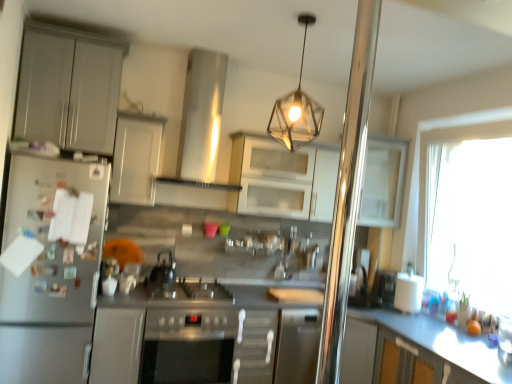
Question: Is stainless steel oven at center at the right side of white matte cabinet at upper center, arranged as the third cabinetry when viewed from the right?

Choices:
 (A) no
 (B) yes

Answer: (B)

Question: Is stainless steel oven at center facing away from white matte cabinet at upper center, arranged as the third cabinetry when viewed from the right?

Choices:
 (A) no
 (B) yes

Answer: (A)

Question: Would you say stainless steel oven at center is outside white matte cabinet at upper center, which is the 3th cabinetry from left to right?

Choices:
 (A) no
 (B) yes

Answer: (B)

Question: Is stainless steel oven at center at the left side of white matte cabinet at upper center, which is the 3th cabinetry from left to right?

Choices:
 (A) yes
 (B) no

Answer: (B)

Question: Is stainless steel oven at center positioned in front of white matte cabinet at upper center, which is the 3th cabinetry from left to right?

Choices:
 (A) yes
 (B) no

Answer: (A)

Question: From a real-world perspective, does stainless steel oven at center stand above white matte cabinet at upper center, arranged as the third cabinetry when viewed from the right?

Choices:
 (A) no
 (B) yes

Answer: (A)

Question: Is white matte cabinet at upper center, which is the 3th cabinetry from left to right, positioned beyond the bounds of matte gray cabinet at lower center, acting as the second cabinetry starting from the left?

Choices:
 (A) yes
 (B) no

Answer: (A)

Question: Considering the relative sizes of white matte cabinet at upper center, which is the 3th cabinetry from left to right, and matte gray cabinet at lower center, the 4th cabinetry from the right, in the image provided, is white matte cabinet at upper center, which is the 3th cabinetry from left to right, smaller than matte gray cabinet at lower center, the 4th cabinetry from the right,?

Choices:
 (A) no
 (B) yes

Answer: (B)

Question: Is white matte cabinet at upper center, arranged as the third cabinetry when viewed from the right, closer to the viewer compared to matte gray cabinet at lower center, acting as the second cabinetry starting from the left?

Choices:
 (A) yes
 (B) no

Answer: (B)

Question: Does white matte cabinet at upper center, arranged as the third cabinetry when viewed from the right, touch matte gray cabinet at lower center, acting as the second cabinetry starting from the left?

Choices:
 (A) yes
 (B) no

Answer: (B)

Question: Is white matte cabinet at upper center, which is the 3th cabinetry from left to right, looking in the opposite direction of matte gray cabinet at lower center, acting as the second cabinetry starting from the left?

Choices:
 (A) no
 (B) yes

Answer: (A)

Question: Can you confirm if white matte cabinet at upper center, which is the 3th cabinetry from left to right, is positioned to the left of matte gray cabinet at lower center, acting as the second cabinetry starting from the left?

Choices:
 (A) no
 (B) yes

Answer: (A)

Question: Is metallic hexagonal light fixture at upper center directly adjacent to white glossy cabinet at upper right, the fifth cabinetry in the left-to-right sequence?

Choices:
 (A) no
 (B) yes

Answer: (A)